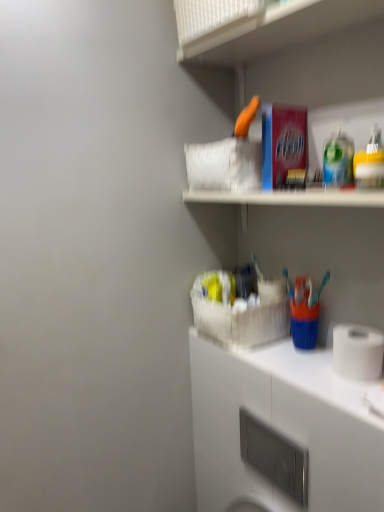
At what (x,y) coordinates should I click in order to perform the action: click on white matte cabinet at lower right. Please return your answer as a coordinate pair (x, y). Looking at the image, I should click on (283, 426).

Locate an element on the screen. The image size is (384, 512). white matte cabinet at lower right is located at coordinates (283, 426).

Based on the photo, is satin nickel soap dispenser at lower center with white matte toilet paper at lower right?

No, satin nickel soap dispenser at lower center is not with white matte toilet paper at lower right.

Does satin nickel soap dispenser at lower center appear on the right side of white matte toilet paper at lower right?

Incorrect, satin nickel soap dispenser at lower center is not on the right side of white matte toilet paper at lower right.

Who is taller, white matte toilet paper at lower right or white plastic basket at upper center?

With more height is white plastic basket at upper center.

Could you tell me if white matte toilet paper at lower right is turned towards white plastic basket at upper center?

No, white matte toilet paper at lower right is not oriented towards white plastic basket at upper center.

Is white matte toilet paper at lower right in contact with white plastic basket at upper center?

No.

Does white matte toilet paper at lower right have a greater width compared to white plastic basket at upper center?

No.

In terms of height, does white matte toilet paper at lower right look taller or shorter compared to satin nickel soap dispenser at lower center?

white matte toilet paper at lower right is shorter than satin nickel soap dispenser at lower center.

Considering the points (351, 378) and (277, 455), which point is in front, point (351, 378) or point (277, 455)?

Positioned in front is point (351, 378).

Is white matte toilet paper at lower right at the left side of satin nickel soap dispenser at lower center?

No.

Would you say white plastic basket at upper center contains white matte cabinet at lower right?

No, white matte cabinet at lower right is not surrounded by white plastic basket at upper center.

Is white plastic basket at upper center positioned in front of white matte cabinet at lower right?

That is True.

From the image's perspective, is white plastic basket at upper center above white matte cabinet at lower right?

Yes.

Is white plastic basket at upper center to the right of white matte cabinet at lower right from the viewer's perspective?

Incorrect, white plastic basket at upper center is not on the right side of white matte cabinet at lower right.

Considering the relative sizes of satin nickel soap dispenser at lower center and white plastic basket at upper center in the image provided, is satin nickel soap dispenser at lower center wider than white plastic basket at upper center?

Incorrect, the width of satin nickel soap dispenser at lower center does not surpass that of white plastic basket at upper center.

Is satin nickel soap dispenser at lower center spatially inside white plastic basket at upper center, or outside of it?

satin nickel soap dispenser at lower center is not enclosed by white plastic basket at upper center.

Image resolution: width=384 pixels, height=512 pixels. Identify the location of appliance below the white plastic basket at upper center (from the image's perspective). (275, 457).

From the image's perspective, is satin nickel soap dispenser at lower center located above or below white plastic basket at upper center?

Based on their image positions, satin nickel soap dispenser at lower center is located beneath white plastic basket at upper center.

From a real-world perspective, does satin nickel soap dispenser at lower center sit lower than white matte cabinet at lower right?

Yes, from a real-world perspective, satin nickel soap dispenser at lower center is below white matte cabinet at lower right.

Looking at this image, considering the relative sizes of satin nickel soap dispenser at lower center and white matte cabinet at lower right in the image provided, is satin nickel soap dispenser at lower center taller than white matte cabinet at lower right?

Indeed, satin nickel soap dispenser at lower center has a greater height compared to white matte cabinet at lower right.

In terms of width, does satin nickel soap dispenser at lower center look wider or thinner when compared to white matte cabinet at lower right?

Considering their sizes, satin nickel soap dispenser at lower center looks slimmer than white matte cabinet at lower right.

Image resolution: width=384 pixels, height=512 pixels. Identify the location of appliance located behind the white matte cabinet at lower right. coord(275,457).

Which object is wider, white matte toilet paper at lower right or white matte cabinet at lower right?

white matte cabinet at lower right is wider.

Considering the relative sizes of white matte toilet paper at lower right and white matte cabinet at lower right in the image provided, is white matte toilet paper at lower right taller than white matte cabinet at lower right?

Yes, white matte toilet paper at lower right is taller than white matte cabinet at lower right.

From a real-world perspective, which object rests below the other?

From a 3D spatial view, white matte cabinet at lower right is below.

Is white matte toilet paper at lower right situated inside white matte cabinet at lower right or outside?

white matte toilet paper at lower right cannot be found inside white matte cabinet at lower right.

Where is `appliance on the left of white matte toilet paper at lower right`? The height and width of the screenshot is (512, 384). appliance on the left of white matte toilet paper at lower right is located at coordinates (275, 457).

The height and width of the screenshot is (512, 384). I want to click on toilet paper below the white plastic basket at upper center (from the image's perspective), so click(358, 352).

Looking at the image, which one is located closer to white matte toilet paper at lower right, white matte cabinet at lower right or white plastic basket at upper center?

Based on the image, white matte cabinet at lower right appears to be nearer to white matte toilet paper at lower right.

Which object lies nearer to the anchor point white matte cabinet at lower right, white matte toilet paper at lower right or satin nickel soap dispenser at lower center?

white matte toilet paper at lower right.

Estimate the real-world distances between objects in this image. Which object is further from white matte cabinet at lower right, white plastic basket at upper center or white matte toilet paper at lower right?

white plastic basket at upper center is positioned further to the anchor white matte cabinet at lower right.

Which object lies further to the anchor point white plastic basket at upper center, white matte toilet paper at lower right or satin nickel soap dispenser at lower center?

satin nickel soap dispenser at lower center lies further to white plastic basket at upper center than the other object.

When comparing their distances from white matte toilet paper at lower right, does white plastic basket at upper center or white matte cabinet at lower right seem closer?

white matte cabinet at lower right is closer to white matte toilet paper at lower right.

From the image, which object appears to be nearer to white plastic basket at upper center, white matte cabinet at lower right or satin nickel soap dispenser at lower center?

white matte cabinet at lower right is positioned closer to the anchor white plastic basket at upper center.

Estimate the real-world distances between objects in this image. Which object is closer to white matte toilet paper at lower right, white plastic basket at upper center or satin nickel soap dispenser at lower center?

white plastic basket at upper center.

Considering their positions, is satin nickel soap dispenser at lower center positioned further to white matte cabinet at lower right than white matte toilet paper at lower right?

satin nickel soap dispenser at lower center is positioned further to the anchor white matte cabinet at lower right.

Where is `toilet paper between white plastic basket at upper center and white matte cabinet at lower right in the up-down direction`? This screenshot has height=512, width=384. toilet paper between white plastic basket at upper center and white matte cabinet at lower right in the up-down direction is located at coordinates (358, 352).

What are the coordinates of `cabinetry between white plastic basket at upper center and satin nickel soap dispenser at lower center in the up-down direction` in the screenshot? It's located at (283, 426).

Locate an element on the screen. Image resolution: width=384 pixels, height=512 pixels. cabinetry between white matte toilet paper at lower right and satin nickel soap dispenser at lower center in the up-down direction is located at coordinates (283, 426).

The width and height of the screenshot is (384, 512). Identify the location of toilet paper between white plastic basket at upper center and satin nickel soap dispenser at lower center from top to bottom. (358, 352).